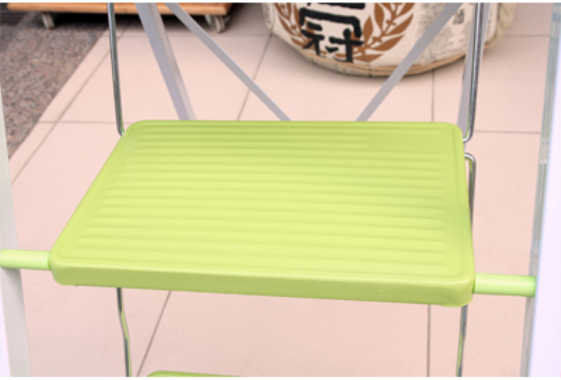
This screenshot has width=561, height=380. Find the location of `chinese characters on pot`. chinese characters on pot is located at coordinates (310, 20).